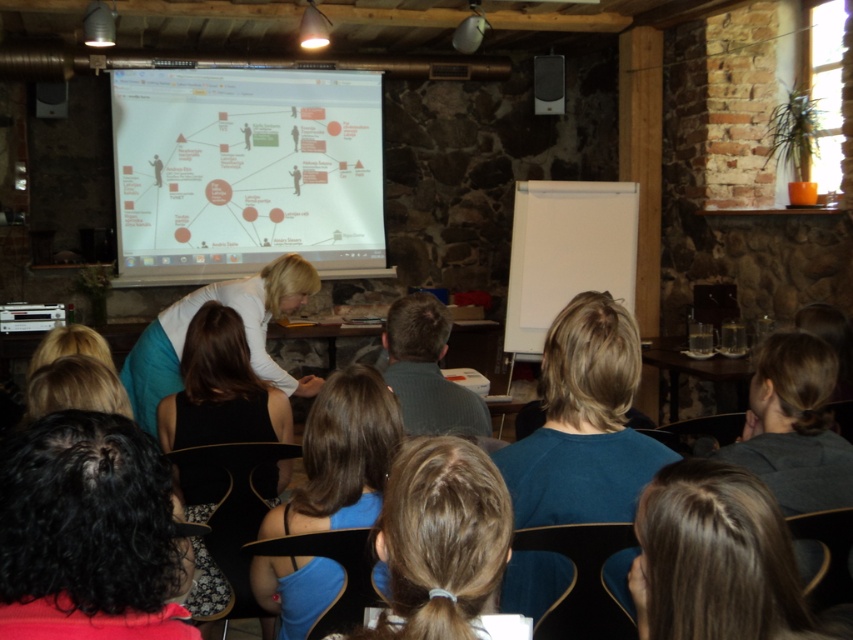
Question: In this image, where is black curly hair at lower left located relative to brown hair at center?

Choices:
 (A) below
 (B) above

Answer: (B)

Question: Among these objects, which one is nearest to the camera?

Choices:
 (A) brown hair at center
 (B) blue fabric hair at center
 (C) black fabric dress at center
 (D) brown hair at lower center

Answer: (A)

Question: Does black curly hair at lower left have a lesser width compared to brown hair at center?

Choices:
 (A) yes
 (B) no

Answer: (B)

Question: Which object is the closest to the black curly hair at lower left?

Choices:
 (A) brown hair at center
 (B) blue fabric hair at center
 (C) teal fabric shirt at center
 (D) black fabric dress at center

Answer: (A)

Question: Which of the following is the farthest from the observer?

Choices:
 (A) brown hair at lower center
 (B) teal fabric shirt at center
 (C) white glossy projector screen at upper center
 (D) black fabric dress at center

Answer: (C)

Question: Does teal fabric shirt at center have a smaller size compared to brown hair at lower center?

Choices:
 (A) yes
 (B) no

Answer: (B)